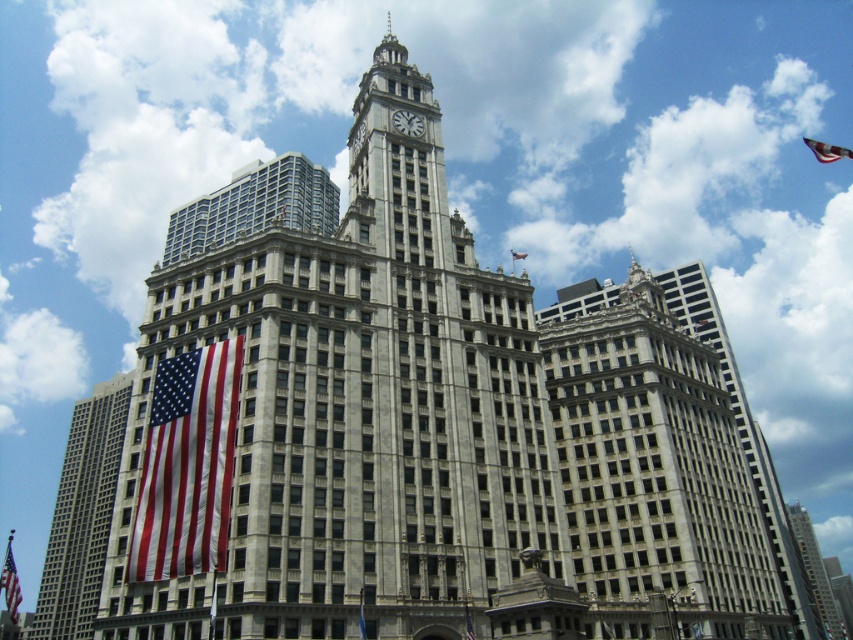
You are standing in front of the gray stone skyscraper at center and want to locate the american flag at left. Based on the scene description, in which direction should you look to see the flag?

The american flag at left is to the left of gray stone skyscraper at center, so you should look to your left to see it.

You are a photographer planning to capture the american flag at left and the gray stone skyscraper at center in a single frame. Considering their sizes, which object should you focus on first to ensure both are clearly visible in your photo?

The american flag at left is smaller in size compared to the gray stone skyscraper at center, so you should focus on the gray stone skyscraper at center first to ensure clarity, then adjust for the smaller american flag at left.

You are standing in front of the gray stone building at center and looking upwards. Is the red fabric flag at upper center located above or below the building?

The red fabric flag at upper center is located above the gray stone building at center because the gray stone building at center is below the red fabric flag at upper center.